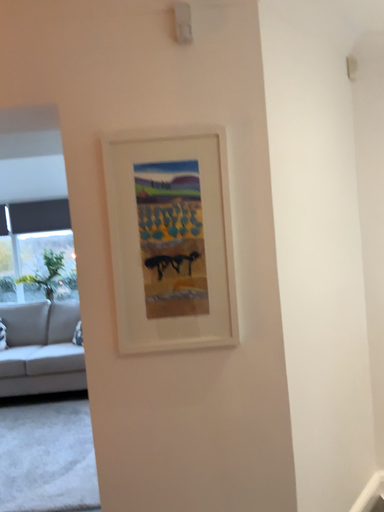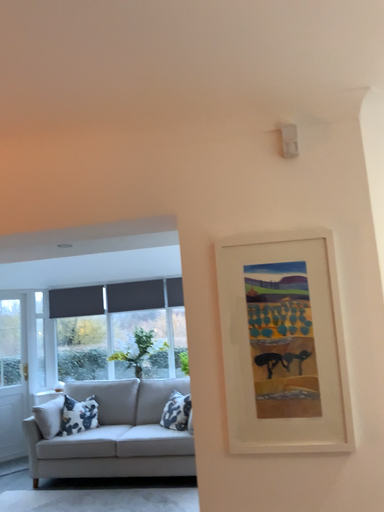
Question: How did the camera likely rotate when shooting the video?

Choices:
 (A) rotated right
 (B) rotated left

Answer: (B)